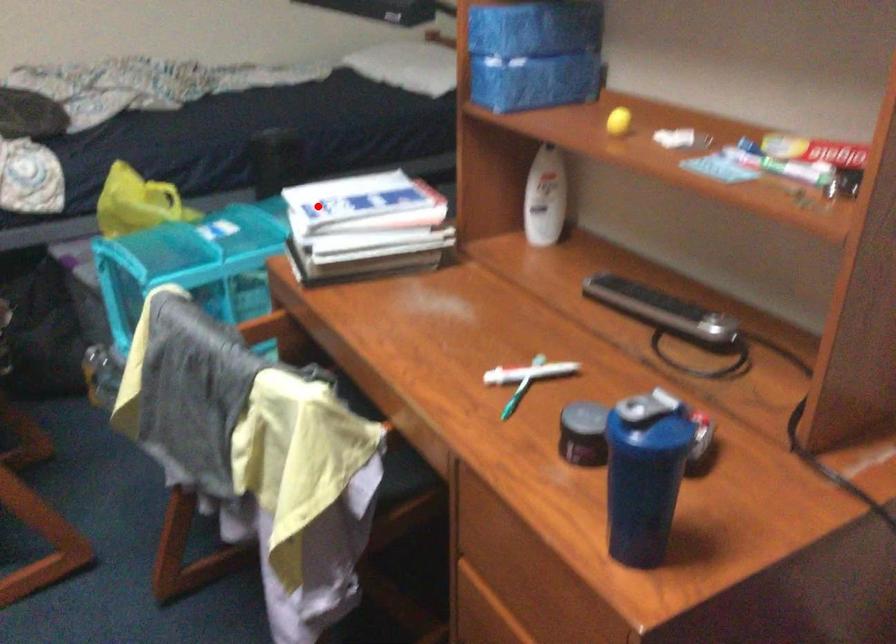
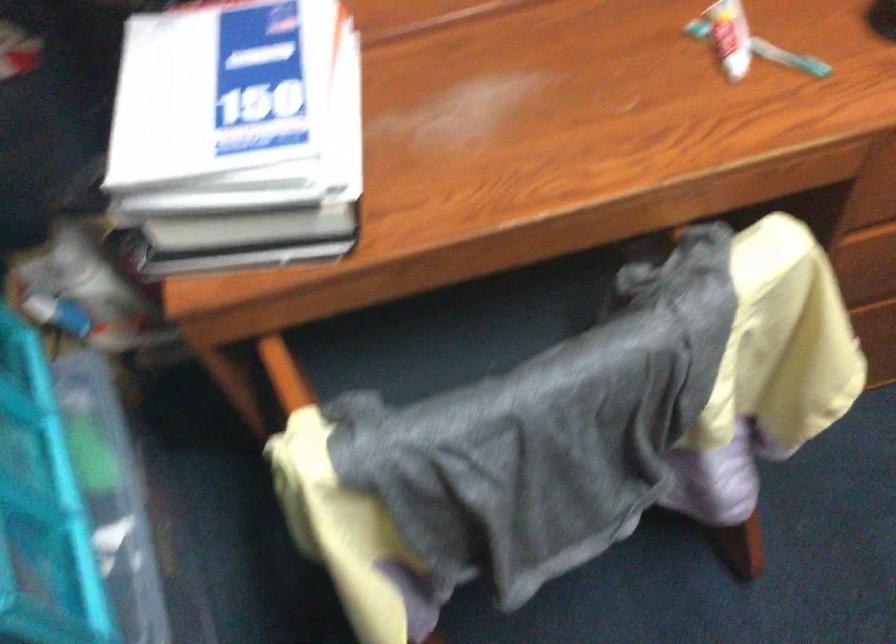
Question: I am providing you with two images of the same scene from different viewpoints. In image1, a red point is highlighted. Considering the same 3D point in image2, which of the following is correct?

Choices:
 (A) It is closer
 (B) It is farther

Answer: (A)